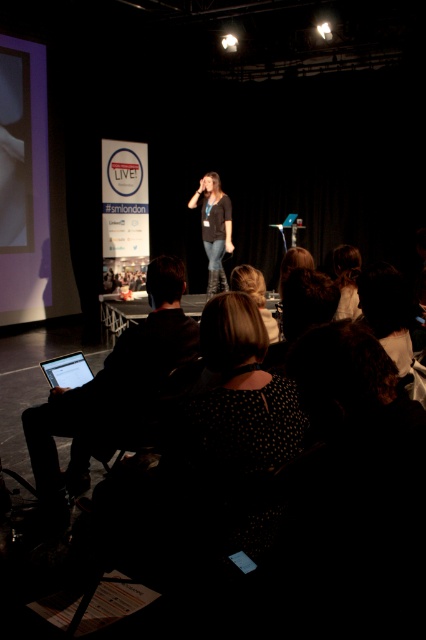
Where is the dark brown leather jacket at center located in the image?

The dark brown leather jacket at center is located at point coordinates of [213,227].

In the scene shown: You are attending a conference and need to identify the speaker. Looking at the stage, you notice the white matte shirt at upper center and the blonde hair at center. Which of these two features is more prominent in size?

The white matte shirt at upper center is bigger than the blonde hair at center, so the white matte shirt at upper center is more prominent in size.